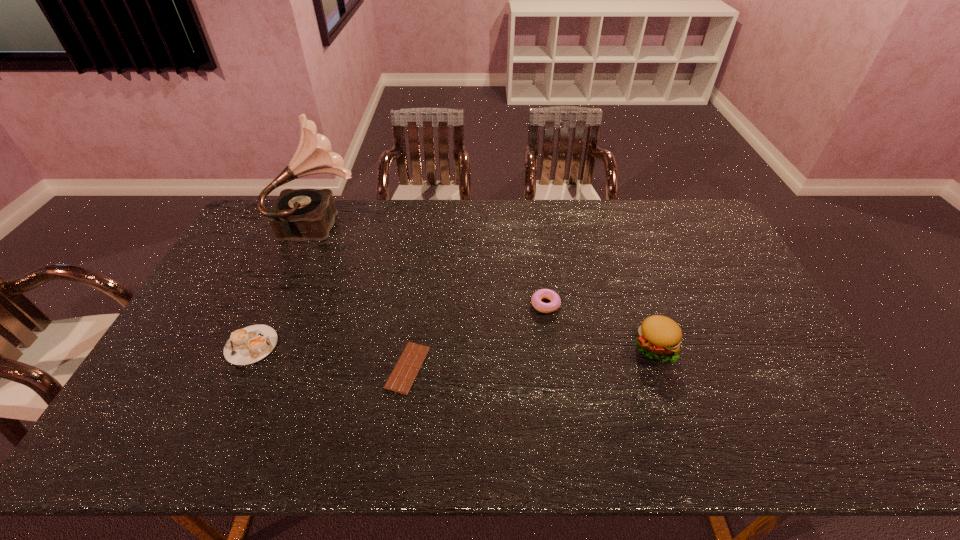
Where is `the farthest object`? the farthest object is located at coordinates (298, 214).

Find the location of a particular element. The image size is (960, 540). record player is located at coordinates coord(298,214).

Locate an element on the screen. The width and height of the screenshot is (960, 540). hamburger is located at coordinates (659, 337).

The image size is (960, 540). What are the coordinates of `the rightmost object` in the screenshot? It's located at (659, 337).

Identify the location of doughnut. (541, 294).

Where is `the fourth object from left to right`? The height and width of the screenshot is (540, 960). the fourth object from left to right is located at coordinates (541, 294).

The width and height of the screenshot is (960, 540). Identify the location of cappuccino. (245, 346).

Find the location of a particular element. The width and height of the screenshot is (960, 540). chocolate bar is located at coordinates (405, 371).

Image resolution: width=960 pixels, height=540 pixels. I want to click on the third object from right to left, so (x=405, y=371).

Locate an element on the screen. vacant area located 0.270m from the horn of the tallest object is located at coordinates 436,222.